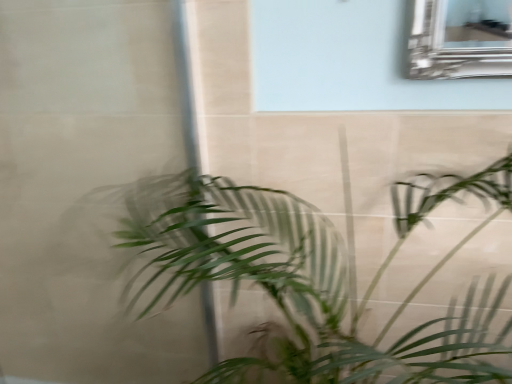
Question: Is transparent glass door at left spatially inside green leafy plant at center, or outside of it?

Choices:
 (A) outside
 (B) inside

Answer: (B)

Question: From their relative heights in the image, would you say transparent glass door at left is taller or shorter than green leafy plant at center?

Choices:
 (A) short
 (B) tall

Answer: (B)

Question: Relative to green leafy plant at center, is transparent glass door at left in front or behind?

Choices:
 (A) front
 (B) behind

Answer: (B)

Question: Does point [x=313, y=264] appear closer or farther from the camera than point [x=159, y=372]?

Choices:
 (A) farther
 (B) closer

Answer: (B)

Question: Considering the positions of green leafy plant at center and transparent glass door at left in the image, is green leafy plant at center bigger or smaller than transparent glass door at left?

Choices:
 (A) big
 (B) small

Answer: (A)

Question: From a real-world perspective, is green leafy plant at center above or below transparent glass door at left?

Choices:
 (A) below
 (B) above

Answer: (A)

Question: Is green leafy plant at center taller or shorter than transparent glass door at left?

Choices:
 (A) tall
 (B) short

Answer: (B)